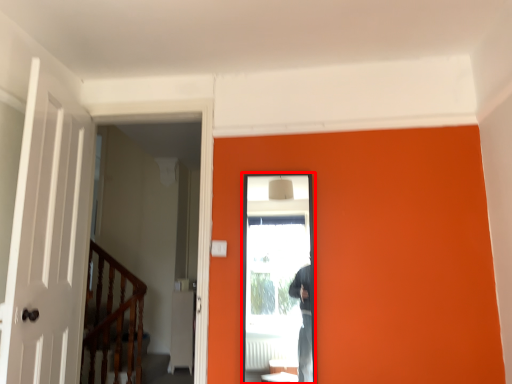
Question: From the image's perspective, where is screen door (annotated by the red box) located in relation to rail in the image?

Choices:
 (A) below
 (B) above

Answer: (B)